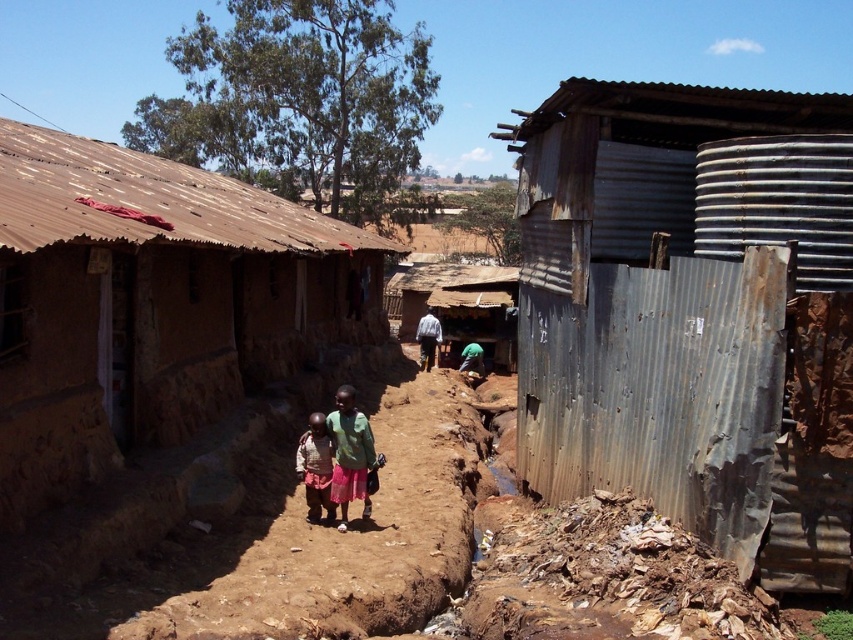
Between rusty corrugated metal hut at right and thatched mud hut at center, which one has more height?

Standing taller between the two is thatched mud hut at center.

Which is more to the right, rusty corrugated metal hut at right or thatched mud hut at center?

Positioned to the right is rusty corrugated metal hut at right.

Is point (694, 196) more distant than point (497, 330)?

No, (694, 196) is in front of (497, 330).

Identify the location of rusty corrugated metal hut at right. This screenshot has height=640, width=853. (693, 314).

Between point (354, 602) and point (306, 468), which one is positioned behind?

Point (306, 468)

Can you confirm if brown dirt track at center is wider than light brown fabric skirt at center?

Yes, brown dirt track at center is wider than light brown fabric skirt at center.

Who is more distant from viewer, (424, 506) or (306, 493)?

The point (424, 506) is more distant.

The height and width of the screenshot is (640, 853). In order to click on brown dirt track at center in this screenshot , I will do `click(352, 540)`.

Between thatched mud hut at center and light brown fabric skirt at center, which one appears on the left side from the viewer's perspective?

Positioned to the left is light brown fabric skirt at center.

Who is more distant from viewer, (454, 324) or (306, 497)?

Positioned behind is point (454, 324).

Locate an element on the screen. Image resolution: width=853 pixels, height=640 pixels. thatched mud hut at center is located at coordinates (462, 307).